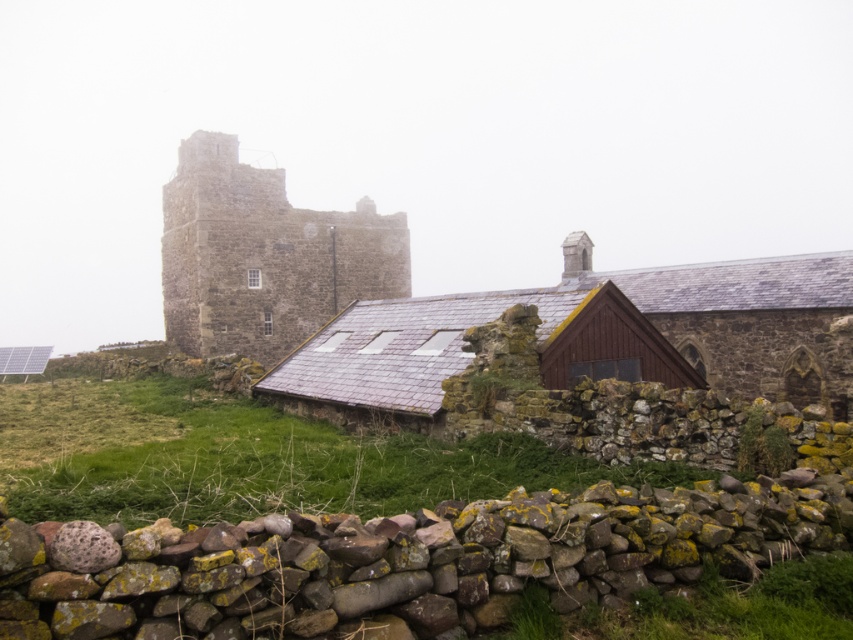
You are a hiker who wants to take a photo of the stone tower at upper left from the green mossy grass at lower center. Is the tower visible from that spot?

The stone tower at upper left is located above green mossy grass at lower center, so the tower is visible from that spot.